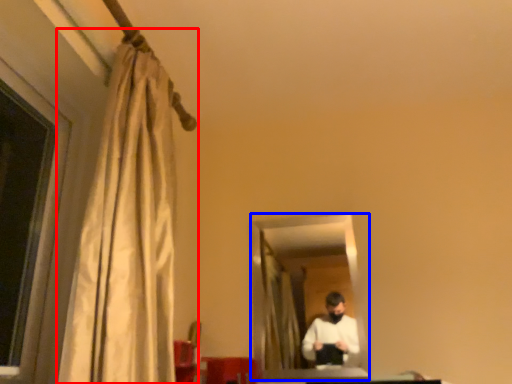
Question: Among these objects, which one is farthest to the camera, curtain (highlighted by a red box) or mirror (highlighted by a blue box)?

Choices:
 (A) curtain
 (B) mirror

Answer: (B)